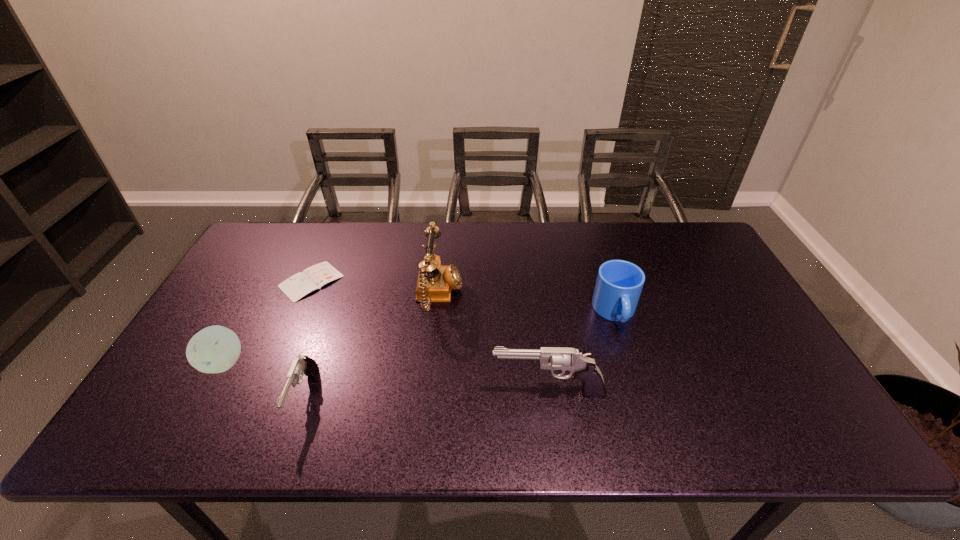
Image resolution: width=960 pixels, height=540 pixels. Find the location of `free spot between the apple and the shortest object`. free spot between the apple and the shortest object is located at coordinates (268, 322).

You are a GUI agent. You are given a task and a screenshot of the screen. Output one action in this format:
    pyautogui.click(x=<x>, y=<y>)
    Task: Click on the vacant area between the mug and the taller gun
    Image resolution: width=960 pixels, height=540 pixels.
    Given the screenshot: What is the action you would take?
    pyautogui.click(x=582, y=352)

The width and height of the screenshot is (960, 540). In order to click on empty space between the shorter gun and the telephone in this screenshot , I will do `click(372, 346)`.

Identify the location of unoccupied position between the tallest object and the mug. (527, 304).

Identify the location of free point between the fifth shortest object and the left gun. (426, 394).

This screenshot has width=960, height=540. I want to click on free space between the right gun and the mug, so click(582, 352).

Select which object appears as the closest to the apple. Please provide its 2D coordinates. Your answer should be formatted as a tuple, i.e. [(x, y)], where the tuple contains the x and y coordinates of a point satisfying the conditions above.

[(303, 364)]

Select which object appears as the third closest to the left gun. Please provide its 2D coordinates. Your answer should be formatted as a tuple, i.e. [(x, y)], where the tuple contains the x and y coordinates of a point satisfying the conditions above.

[(434, 284)]

Locate an element on the screen. free space in the image that satisfies the following two spatial constraints: 1. on the side of the mug with the handle; 2. at the muzzle of the right gun is located at coordinates (640, 392).

Locate an element on the screen. free point that satisfies the following two spatial constraints: 1. at the muzzle of the right gun; 2. at the muzzle of the shorter gun is located at coordinates (549, 396).